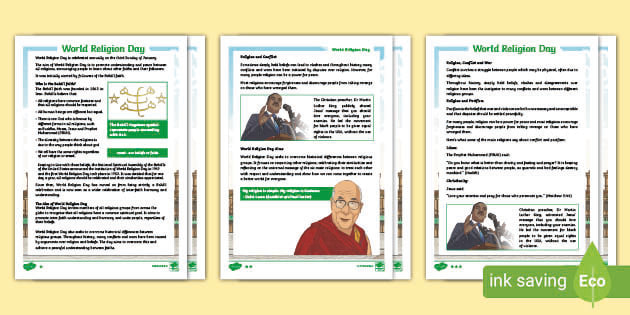
I want to click on first poster, so click(x=137, y=228).